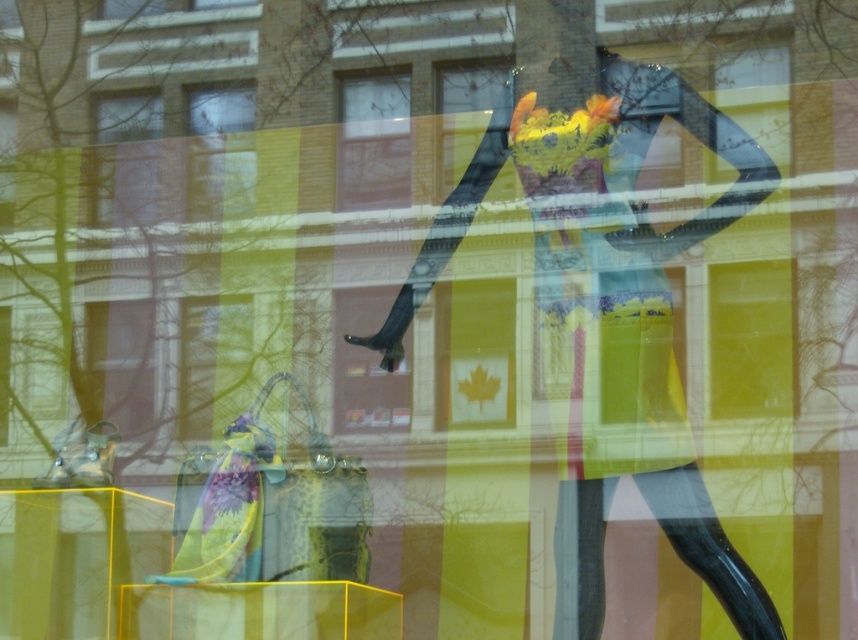
Question: Which point is closer to the camera?

Choices:
 (A) clear glass window at upper left
 (B) transparent glass window at center
 (C) floral silk dress at center

Answer: (C)

Question: Considering the real-world distances, which object is closest to the clear glass window at upper left?

Choices:
 (A) matte black shoe at center
 (B) matte black dress at center
 (C) matte yellow purse at center
 (D) transparent glass window at center

Answer: (C)

Question: Which of the following is the closest to the observer?

Choices:
 (A) (650, 333)
 (B) (351, 172)
 (C) (246, 92)

Answer: (A)

Question: Is floral silk dress at center wider than matte yellow purse at center?

Choices:
 (A) yes
 (B) no

Answer: (A)

Question: Does floral dress at center have a smaller size compared to matte glass window at upper center?

Choices:
 (A) no
 (B) yes

Answer: (A)

Question: Does matte black shoe at center appear on the left side of clear glass window at upper left?

Choices:
 (A) yes
 (B) no

Answer: (B)